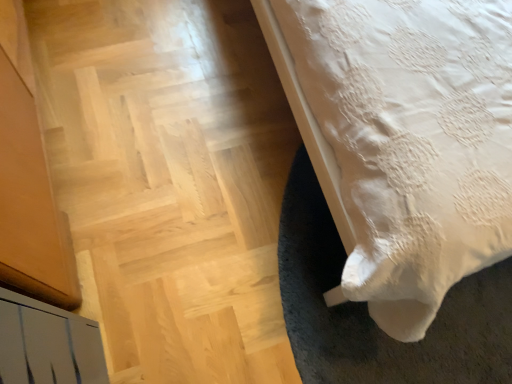
Question: Considering the positions of white lace bed at lower right and wooden parquet floor at lower left in the image, is white lace bed at lower right wider or thinner than wooden parquet floor at lower left?

Choices:
 (A) wide
 (B) thin

Answer: (B)

Question: From a real-world perspective, is white lace bed at lower right above or below wooden parquet floor at lower left?

Choices:
 (A) below
 (B) above

Answer: (B)

Question: Relative to wooden parquet floor at lower left, is white lace bed at lower right in front or behind?

Choices:
 (A) front
 (B) behind

Answer: (A)

Question: Considering the positions of wooden parquet floor at lower left and white lace bed at lower right in the image, is wooden parquet floor at lower left bigger or smaller than white lace bed at lower right?

Choices:
 (A) big
 (B) small

Answer: (B)

Question: Considering the positions of wooden parquet floor at lower left and white lace bed at lower right in the image, is wooden parquet floor at lower left wider or thinner than white lace bed at lower right?

Choices:
 (A) wide
 (B) thin

Answer: (A)

Question: Is wooden parquet floor at lower left in front of or behind white lace bed at lower right in the image?

Choices:
 (A) front
 (B) behind

Answer: (B)

Question: From a real-world perspective, is wooden parquet floor at lower left physically located above or below white lace bed at lower right?

Choices:
 (A) below
 (B) above

Answer: (A)